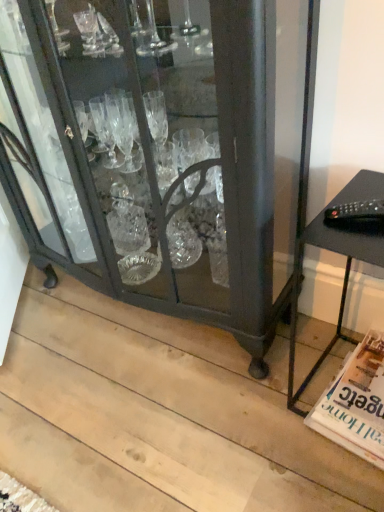
Identify the location of vacant space in front of matte black cabinet at center. (153, 423).